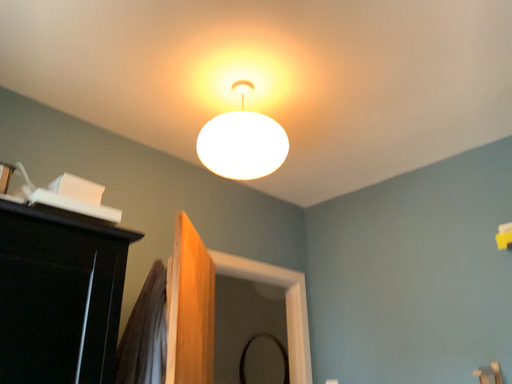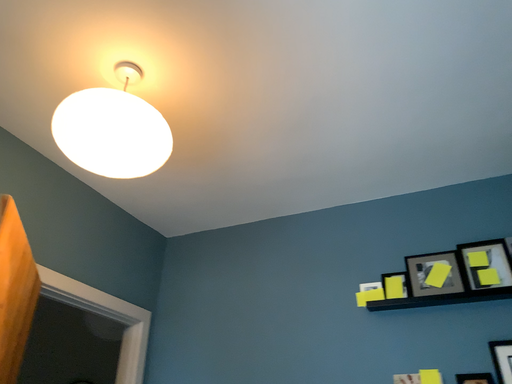
Question: How did the camera likely rotate when shooting the video?

Choices:
 (A) rotated left
 (B) rotated right

Answer: (B)